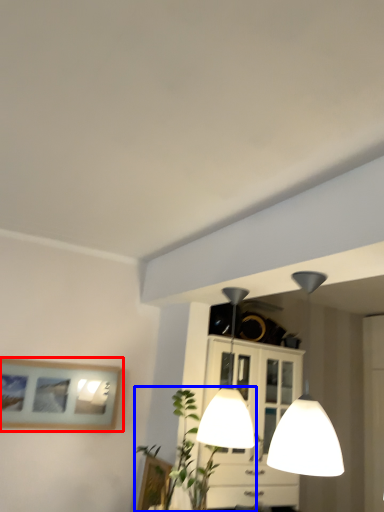
Question: Which object is closer to the camera taking this photo, picture frame (highlighted by a red box) or plant (highlighted by a blue box)?

Choices:
 (A) picture frame
 (B) plant

Answer: (B)